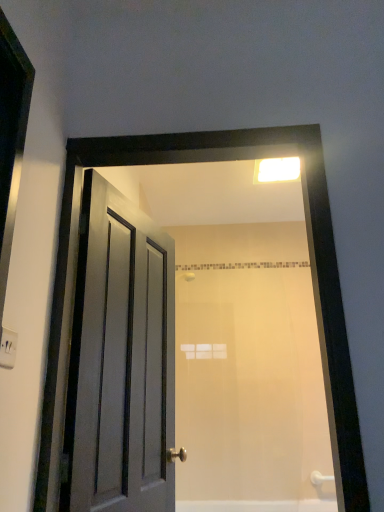
Question: Considering the positions of white matte bathtub at lower center and matte wooden door at center in the image, is white matte bathtub at lower center bigger or smaller than matte wooden door at center?

Choices:
 (A) small
 (B) big

Answer: (A)

Question: Considering the positions of white matte bathtub at lower center and matte wooden door at center in the image, is white matte bathtub at lower center taller or shorter than matte wooden door at center?

Choices:
 (A) tall
 (B) short

Answer: (B)

Question: Estimate the real-world distances between objects in this image. Which object is farther from the white plastic light fixture at upper center?

Choices:
 (A) white plastic electric outlet at upper left
 (B) matte wooden door at center
 (C) white matte bathtub at lower center
 (D) matte gray door at left

Answer: (C)

Question: Which object is positioned closest to the matte gray door at left?

Choices:
 (A) white plastic electric outlet at upper left
 (B) matte wooden door at center
 (C) white plastic light fixture at upper center
 (D) white matte bathtub at lower center

Answer: (A)